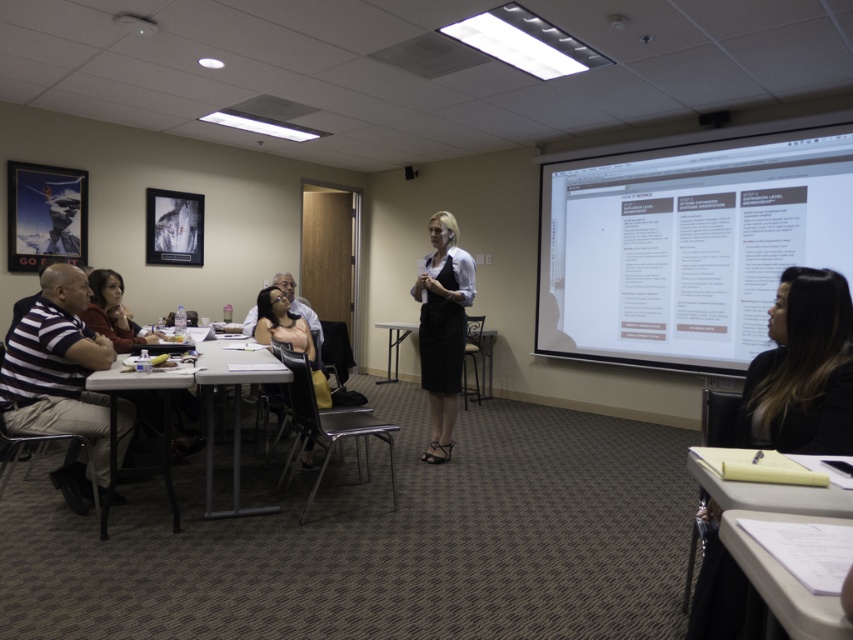
You are a participant in the conference room and want to move from your seat to the white plastic table at lower left to grab a pen. However, there is a presentation ongoing on the white matte projection screen at upper right. Will you have to walk in front of the screen to reach the table?

The white matte projection screen at upper right is further to the viewer than the white plastic table at lower left, so you would have to walk in front of the screen to reach the table.

A person is standing at point A located at coordinates (285, 328). What object is closest to this point?

The closest object to point A located at coordinates (285, 328) is the matte black dress at lower center.

Looking at this image, you are a photographer setting up a shoot in a conference room. You have a matte black dress at lower center and a metallic silver table at center. Which object is positioned higher in the scene?

The matte black dress at lower center is located above the metallic silver table at center, so it is positioned higher in the scene.